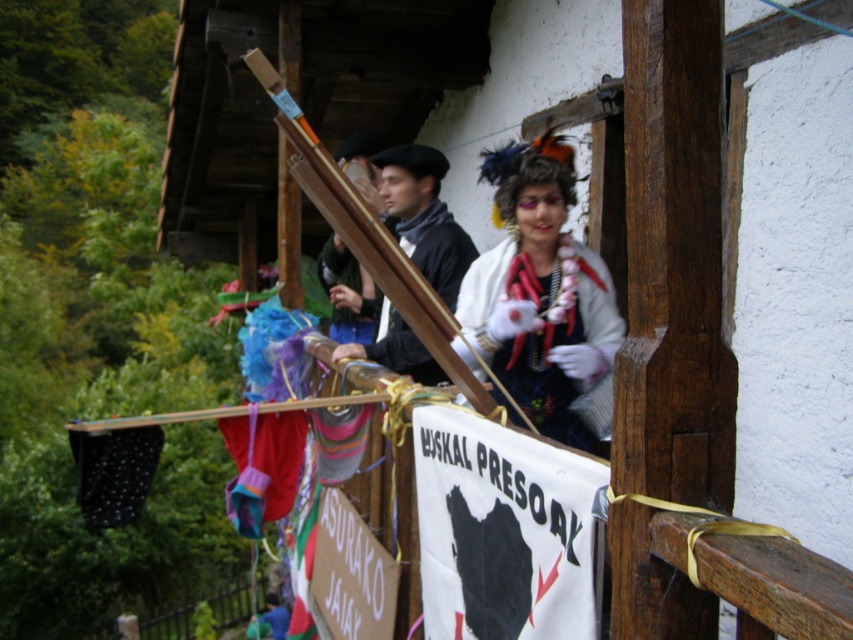
Who is higher up, fuzzy white scarf at upper center or velvet red gloves at center?

velvet red gloves at center

Does fuzzy white scarf at upper center appear on the left side of velvet red gloves at center?

No, fuzzy white scarf at upper center is not to the left of velvet red gloves at center.

The image size is (853, 640). What are the coordinates of `fuzzy white scarf at upper center` in the screenshot? It's located at tap(538, 294).

Can you confirm if black matte beret at center is shorter than matte blue fabric at center?

Correct, black matte beret at center is not as tall as matte blue fabric at center.

Can you confirm if black matte beret at center is taller than matte blue fabric at center?

No.

What do you see at coordinates (343, 269) in the screenshot? The height and width of the screenshot is (640, 853). I see `black matte beret at center` at bounding box center [343, 269].

The height and width of the screenshot is (640, 853). In order to click on black matte beret at center in this screenshot , I will do `click(343, 269)`.

The image size is (853, 640). What do you see at coordinates (538, 294) in the screenshot? I see `fuzzy white scarf at upper center` at bounding box center [538, 294].

Can you confirm if fuzzy white scarf at upper center is positioned above matte blue fabric at center?

Actually, fuzzy white scarf at upper center is below matte blue fabric at center.

Is point (606, 289) farther from viewer compared to point (321, 252)?

No, (606, 289) is in front of (321, 252).

You are a GUI agent. You are given a task and a screenshot of the screen. Output one action in this format:
    pyautogui.click(x=<x>, y=<y>)
    Task: Click on the fuzzy white scarf at upper center
    The image size is (853, 640).
    Given the screenshot: What is the action you would take?
    pyautogui.click(x=538, y=294)